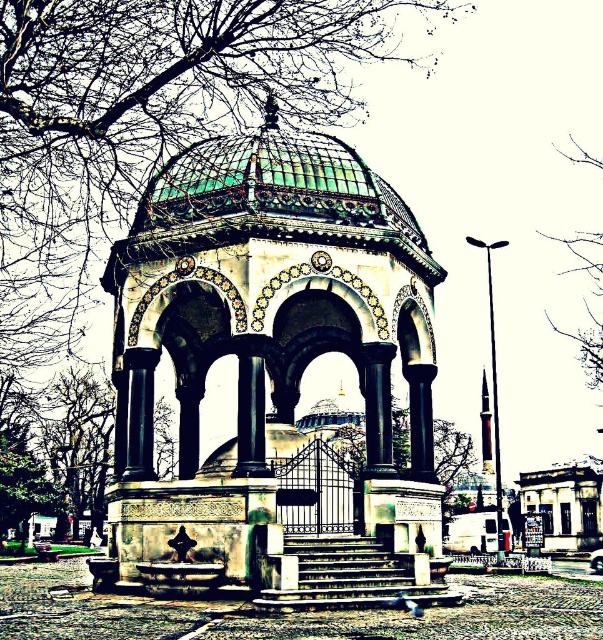
Question: Is white marble gazebo at center positioned at the back of bare branches at upper right?

Choices:
 (A) no
 (B) yes

Answer: (A)

Question: Does white marble gazebo at center have a smaller size compared to bare branches at upper right?

Choices:
 (A) yes
 (B) no

Answer: (B)

Question: Which point is farther to the camera?

Choices:
 (A) (601, 316)
 (B) (388, 195)

Answer: (A)

Question: Can you confirm if white marble gazebo at center is wider than bare branches at upper right?

Choices:
 (A) no
 (B) yes

Answer: (B)

Question: Among these points, which one is nearest to the camera?

Choices:
 (A) (364, 212)
 (B) (570, 152)

Answer: (A)